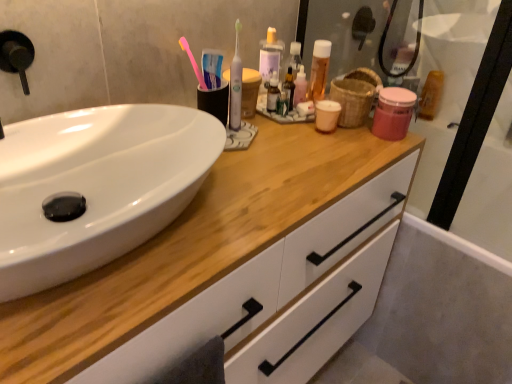
Question: Based on their positions, is white glossy toothbrush at center, acting as the 2th toothbrush starting from the left, located to the left or right of bamboo basket at upper right?

Choices:
 (A) left
 (B) right

Answer: (A)

Question: Is point (238, 104) positioned closer to the camera than point (351, 122)?

Choices:
 (A) farther
 (B) closer

Answer: (B)

Question: Based on their relative distances, which object is farther from the white glossy toothbrush at center, acting as the 2th toothbrush starting from the left?

Choices:
 (A) translucent plastic mouthwash at upper right, the first mouthwash when ordered from back to front
 (B) black matte faucet at upper left
 (C) pink matte jar at upper right, which is the second mouthwash in right-to-left order
 (D) white matte cabinet at center
 (E) translucent plastic mouthwash at center, the third mouthwash viewed from the right

Answer: (A)

Question: Which is farther from the pink plastic toothbrush at upper center, which is the 2th toothbrush from right to left?

Choices:
 (A) translucent plastic mouthwash at upper right, which ranks as the 1th mouthwash in right-to-left order
 (B) translucent plastic mouthwash at center, the 2th mouthwash from the back
 (C) white matte cabinet at center
 (D) white glossy sink at left
 (E) white glossy toothbrush at center, acting as the 2th toothbrush starting from the left

Answer: (A)